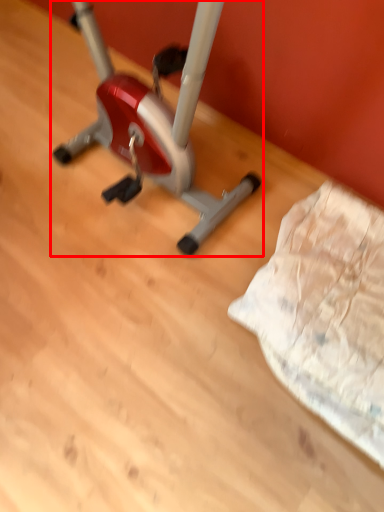
Question: From the image, what is the correct spatial relationship of stationary bicycle (annotated by the red box) in relation to sheet?

Choices:
 (A) left
 (B) right

Answer: (A)